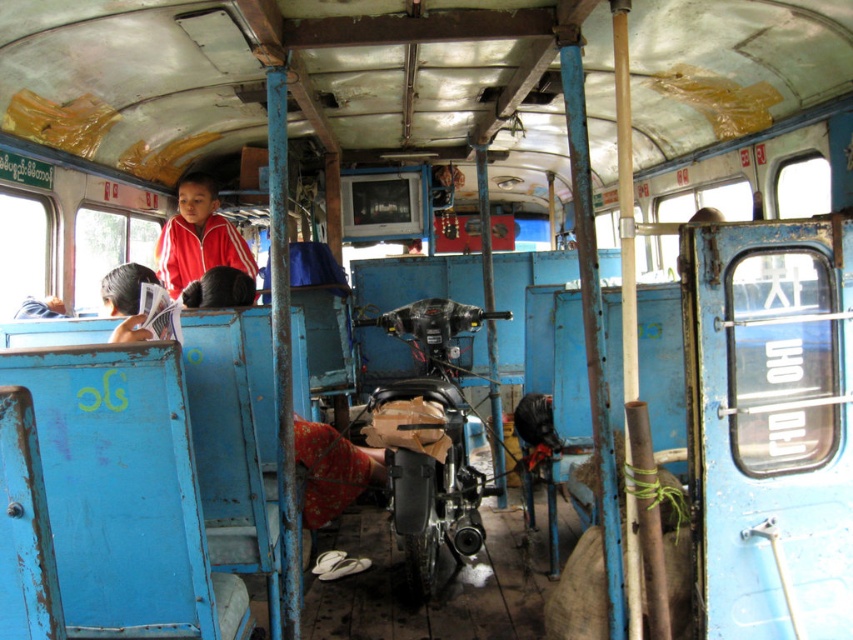
Question: Which of the following is the closest to the observer?

Choices:
 (A) dark blue fabric jacket at upper left
 (B) red matte jacket at upper left

Answer: (A)

Question: Can you confirm if matte black motorcycle at center is positioned below black hair at upper left?

Choices:
 (A) no
 (B) yes

Answer: (B)

Question: Is red matte jacket at upper left below black hair at upper left?

Choices:
 (A) no
 (B) yes

Answer: (A)

Question: Does red matte jacket at upper left appear under dark blue fabric jacket at upper left?

Choices:
 (A) no
 (B) yes

Answer: (A)

Question: Which point is farther to the camera?

Choices:
 (A) (242, 294)
 (B) (387, 436)
 (C) (132, 273)
 (D) (236, 266)

Answer: (D)

Question: Which object is the farthest from the dark blue fabric jacket at upper left?

Choices:
 (A) black hair at upper left
 (B) matte black motorcycle at center

Answer: (B)